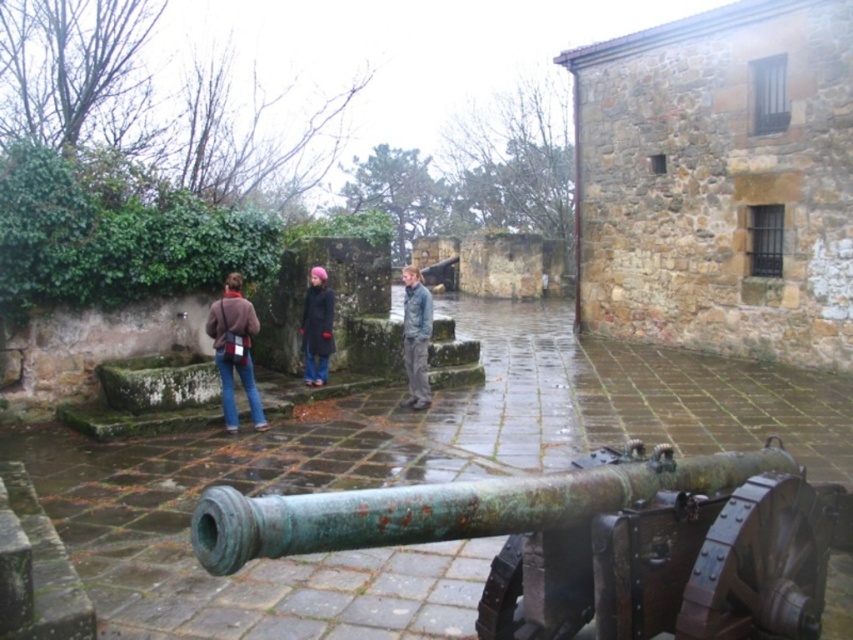
Question: Does brown leather jacket at lower left have a lesser width compared to dark blue coat at center?

Choices:
 (A) no
 (B) yes

Answer: (A)

Question: Which point is farther to the camera?

Choices:
 (A) brown leather jacket at lower left
 (B) dark blue coat at center
 (C) denim jacket at center
 (D) rusty green metal cannon at center

Answer: (B)

Question: Is rusty green metal cannon at center closer to the viewer compared to denim jacket at center?

Choices:
 (A) yes
 (B) no

Answer: (A)

Question: Which object is closer to the camera taking this photo?

Choices:
 (A) dark blue coat at center
 (B) denim jacket at center

Answer: (B)

Question: Can you confirm if brown leather jacket at lower left is positioned to the right of dark blue coat at center?

Choices:
 (A) yes
 (B) no

Answer: (B)

Question: Which point appears closest to the camera in this image?

Choices:
 (A) 625,544
 (B) 300,320

Answer: (A)